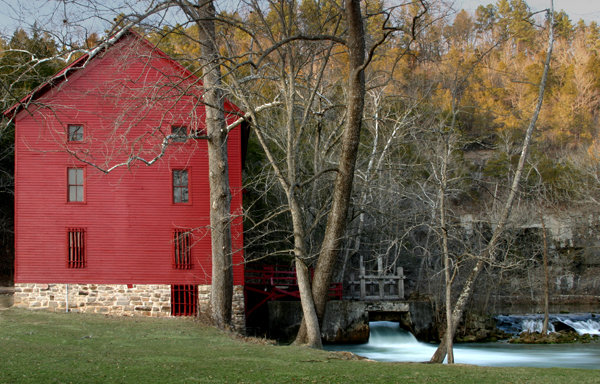
You are a GUI agent. You are given a task and a screenshot of the screen. Output one action in this format:
    pyautogui.click(x=<x>, y=<y>)
    Task: Click on the red windows with bars
    The height and width of the screenshot is (384, 600).
    Given the screenshot: What is the action you would take?
    pyautogui.click(x=76, y=247), pyautogui.click(x=179, y=252), pyautogui.click(x=187, y=300)